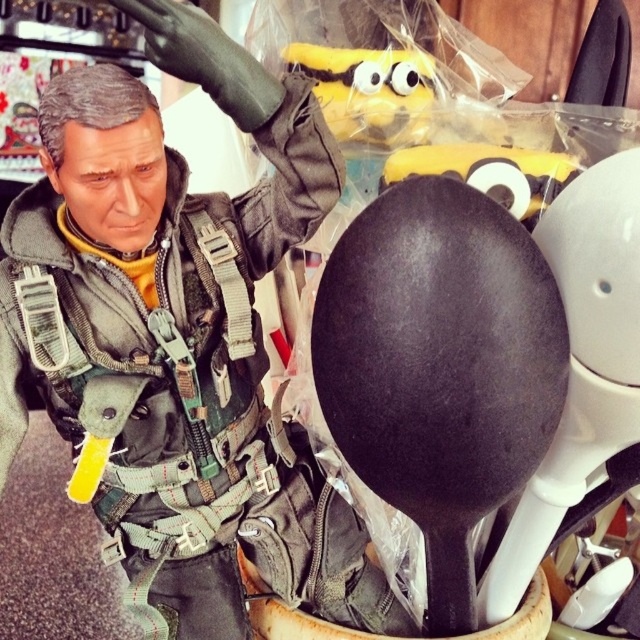
Question: Which of the following is the farthest from the observer?

Choices:
 (A) (356, 246)
 (B) (356, 122)
 (C) (92, 248)

Answer: (B)

Question: Among these objects, which one is nearest to the camera?

Choices:
 (A) black matte spoon at center
 (B) matte black helmet at upper right
 (C) yellow plush toy at upper center

Answer: (A)

Question: Can you confirm if matte black helmet at upper right is thinner than black matte spoon at center?

Choices:
 (A) no
 (B) yes

Answer: (A)

Question: From the image, what is the correct spatial relationship of black matte spoon at center in relation to yellow plush toy at upper center?

Choices:
 (A) left
 (B) right

Answer: (B)

Question: Which point is closer to the camera?

Choices:
 (A) matte black helmet at upper right
 (B) black matte spoon at center

Answer: (B)

Question: Is matte black helmet at upper right to the right of yellow plush toy at upper center from the viewer's perspective?

Choices:
 (A) no
 (B) yes

Answer: (A)